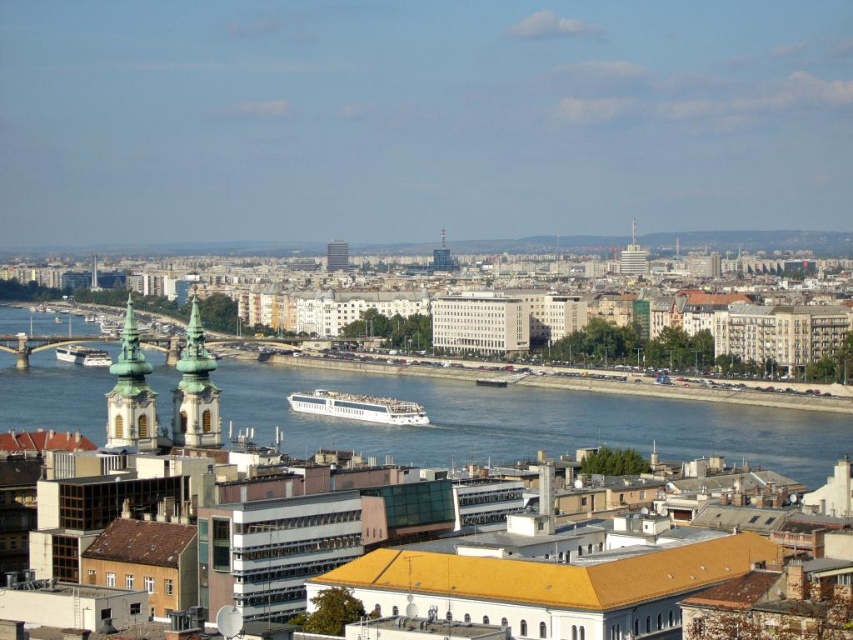
How far apart are green stone tower at center-left and matte glass skyscraper at center?

green stone tower at center-left is 70.43 meters away from matte glass skyscraper at center.

Does point (184, 424) come farther from viewer compared to point (335, 260)?

That is False.

Between point (218, 397) and point (341, 260), which one is positioned in front?

Positioned in front is point (218, 397).

This screenshot has height=640, width=853. In order to click on green stone tower at center-left in this screenshot , I will do `click(195, 390)`.

Is point (151, 432) behind point (329, 404)?

No, (151, 432) is in front of (329, 404).

Does point (103, 445) come behind point (322, 404)?

No, (103, 445) is closer to viewer.

What are the coordinates of `green stone tower at center` in the screenshot? It's located at (131, 394).

Is white glossy cruise ship at center to the right of smooth glass skyscraper at center from the viewer's perspective?

No, white glossy cruise ship at center is not to the right of smooth glass skyscraper at center.

Which is behind, point (357, 410) or point (440, 260)?

Positioned behind is point (440, 260).

Image resolution: width=853 pixels, height=640 pixels. I want to click on white glossy cruise ship at center, so click(x=358, y=406).